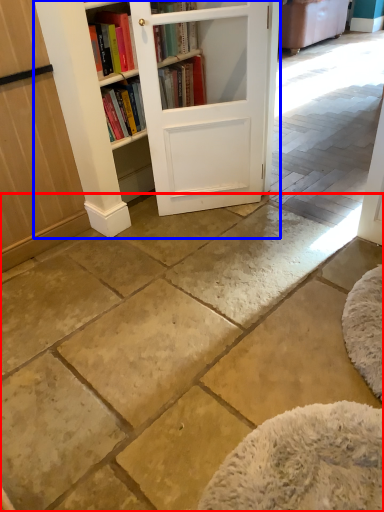
Question: Which of the following is the farthest to the observer, concrete (highlighted by a red box) or bookcase (highlighted by a blue box)?

Choices:
 (A) concrete
 (B) bookcase

Answer: (B)